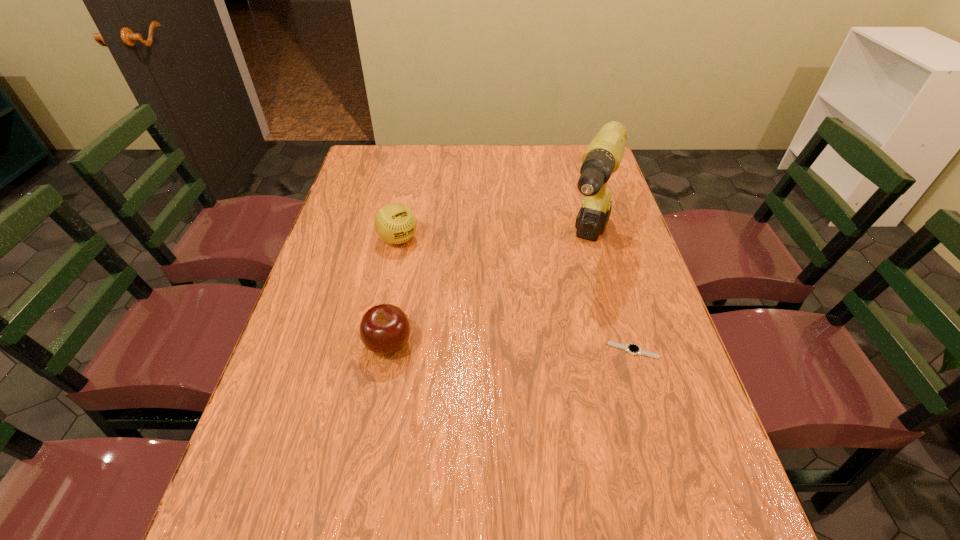
Locate an element on the screen. This screenshot has width=960, height=540. blank region between the softball and the shortest object is located at coordinates (516, 295).

Where is `free space between the watch and the apple`? The height and width of the screenshot is (540, 960). free space between the watch and the apple is located at coordinates [x=511, y=347].

Image resolution: width=960 pixels, height=540 pixels. What are the coordinates of `vacant area that lies between the shortest object and the apple` in the screenshot? It's located at (511, 347).

Where is `vacant region between the apple and the watch`? vacant region between the apple and the watch is located at coordinates (511, 347).

Where is `vacant space that's between the tallest object and the apple`? The width and height of the screenshot is (960, 540). vacant space that's between the tallest object and the apple is located at coordinates (488, 294).

Where is `unoccupied position between the tallest object and the apple`? unoccupied position between the tallest object and the apple is located at coordinates (x=488, y=294).

Locate an element on the screen. free point between the apple and the tallest object is located at coordinates (488, 294).

Image resolution: width=960 pixels, height=540 pixels. I want to click on vacant region between the drill and the apple, so [x=488, y=294].

At what (x,y) coordinates should I click in order to perform the action: click on object that is the third closest to the softball. Please return your answer as a coordinate pair (x, y). The height and width of the screenshot is (540, 960). Looking at the image, I should click on (633, 349).

The height and width of the screenshot is (540, 960). Find the location of `object that can be found as the closest to the apple`. object that can be found as the closest to the apple is located at coordinates (395, 223).